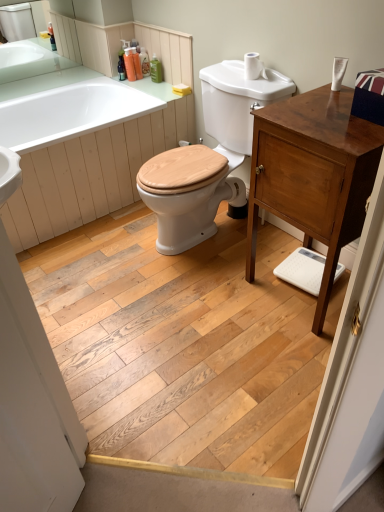
This screenshot has height=512, width=384. I want to click on free location to the left of shiny brown cabinet at right, so click(x=230, y=306).